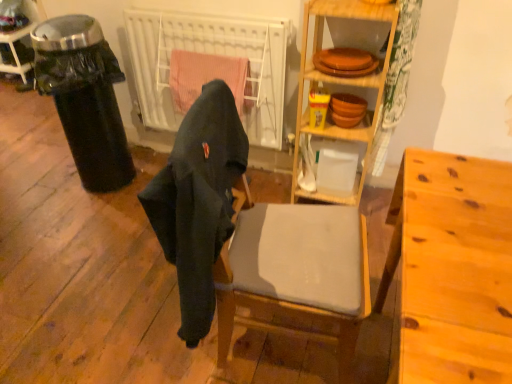
Question: Should I look upward or downward to see black plastic trash can at left?

Choices:
 (A) down
 (B) up

Answer: (B)

Question: Does wooden shelves at center have a lesser width compared to dark gray fabric chair at center?

Choices:
 (A) yes
 (B) no

Answer: (B)

Question: Is wooden shelves at center completely or partially outside of dark gray fabric chair at center?

Choices:
 (A) yes
 (B) no

Answer: (A)

Question: Can you confirm if wooden shelves at center is shorter than dark gray fabric chair at center?

Choices:
 (A) yes
 (B) no

Answer: (B)

Question: From the image's perspective, is wooden shelves at center under dark gray fabric chair at center?

Choices:
 (A) no
 (B) yes

Answer: (A)

Question: Are wooden shelves at center and dark gray fabric chair at center making contact?

Choices:
 (A) no
 (B) yes

Answer: (A)

Question: Is wooden shelves at center further to camera compared to dark gray fabric chair at center?

Choices:
 (A) no
 (B) yes

Answer: (B)

Question: Is black plastic trash can at left bigger than light brown wood desk at right?

Choices:
 (A) yes
 (B) no

Answer: (B)

Question: From a real-world perspective, is black plastic trash can at left located higher than light brown wood desk at right?

Choices:
 (A) yes
 (B) no

Answer: (A)

Question: Can you confirm if black plastic trash can at left is smaller than light brown wood desk at right?

Choices:
 (A) no
 (B) yes

Answer: (B)

Question: Is black plastic trash can at left shorter than light brown wood desk at right?

Choices:
 (A) yes
 (B) no

Answer: (B)

Question: From the image's perspective, is black plastic trash can at left on top of light brown wood desk at right?

Choices:
 (A) yes
 (B) no

Answer: (A)

Question: Is black plastic trash can at left not inside light brown wood desk at right?

Choices:
 (A) yes
 (B) no

Answer: (A)

Question: Does matte gray cushioned chair at center contain wooden shelves at center?

Choices:
 (A) no
 (B) yes

Answer: (A)